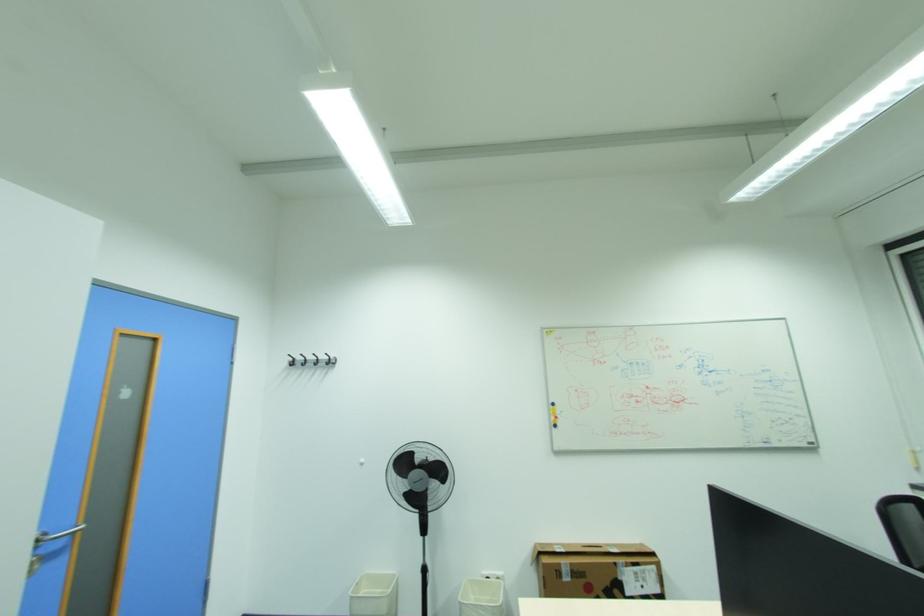
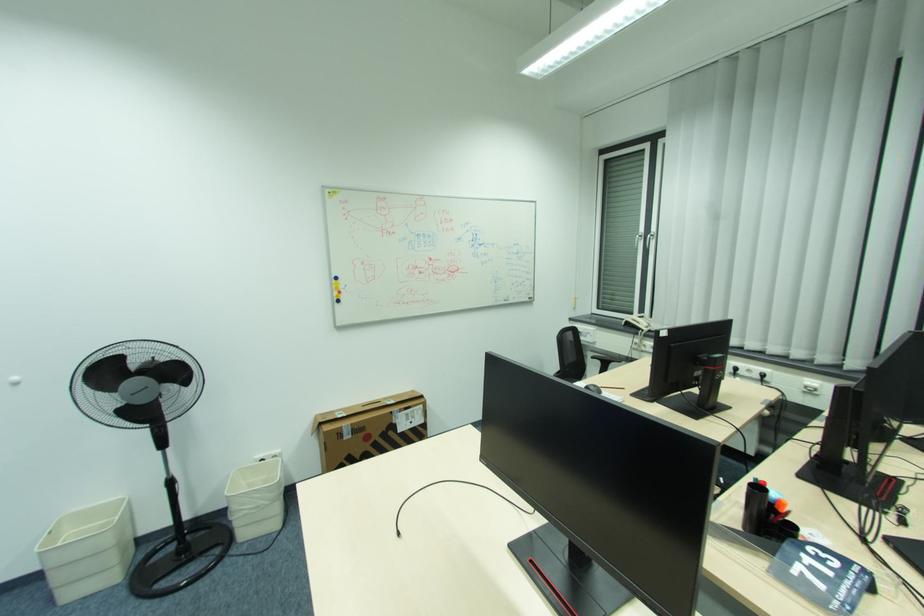
The first image is from the beginning of the video and the second image is from the end. How did the camera likely rotate when shooting the video?

The camera's rotation is toward right-down.